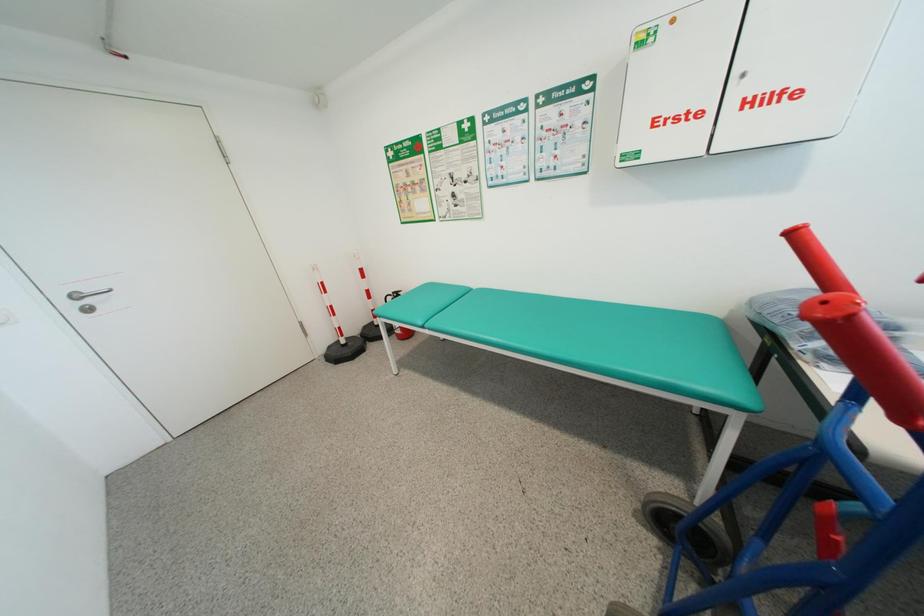
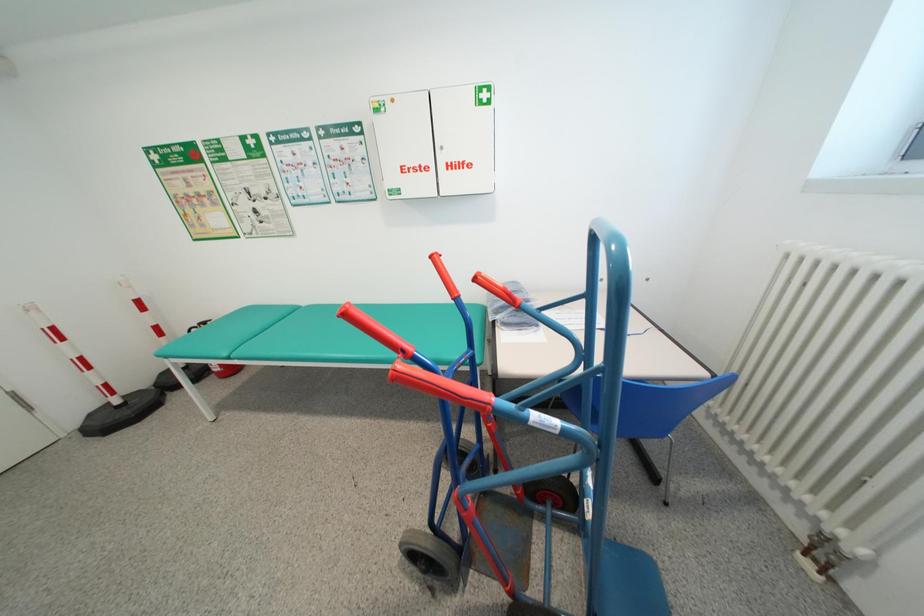
Question: The first image is from the beginning of the video and the second image is from the end. How did the camera likely rotate when shooting the video?

Choices:
 (A) Left
 (B) Right
 (C) Up
 (D) Down

Answer: (B)